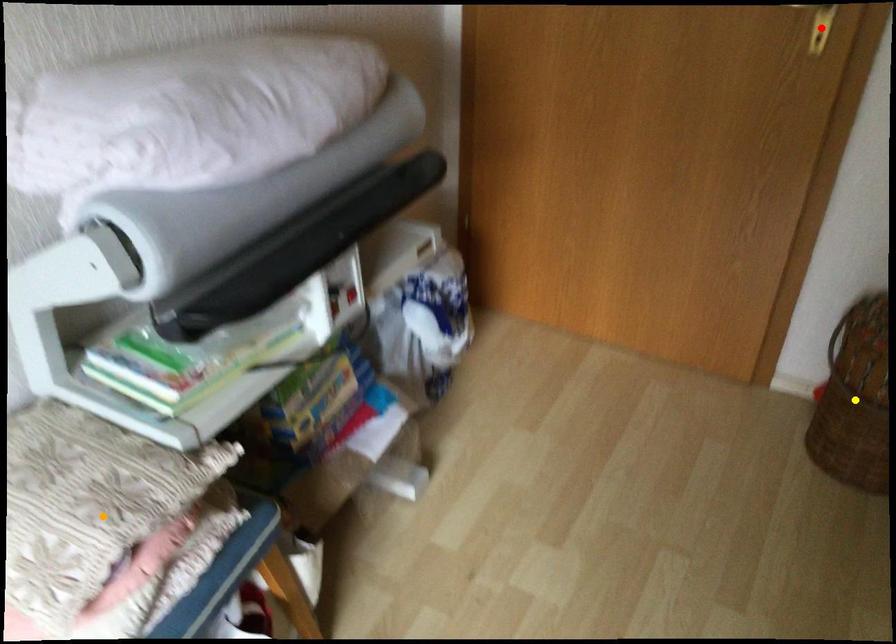
Order these from nearest to farthest:
A) red point
B) yellow point
C) orange point

1. orange point
2. red point
3. yellow point